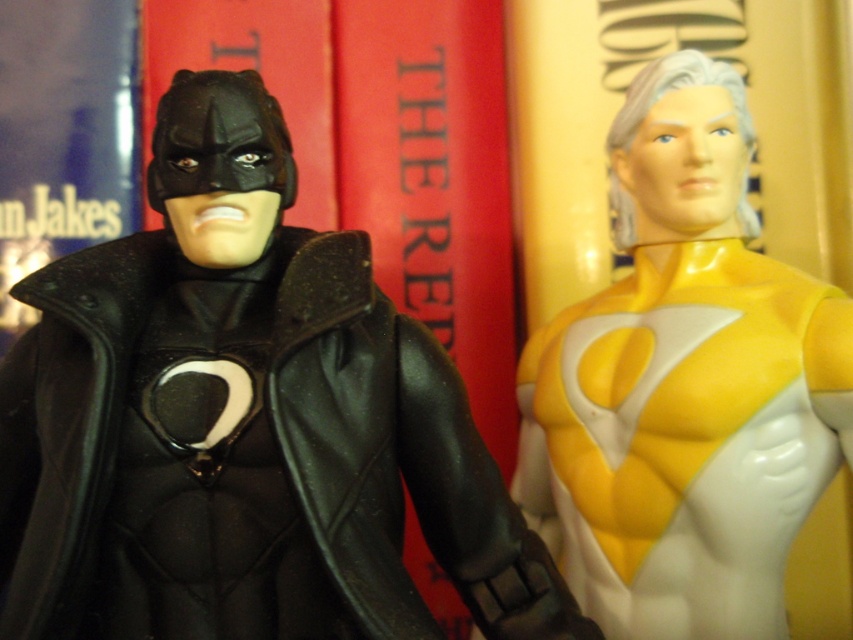
Between point (167, 292) and point (740, 109), which one is positioned behind?

Point (740, 109)

Where is `matte black suit at left`? matte black suit at left is located at coordinates (242, 422).